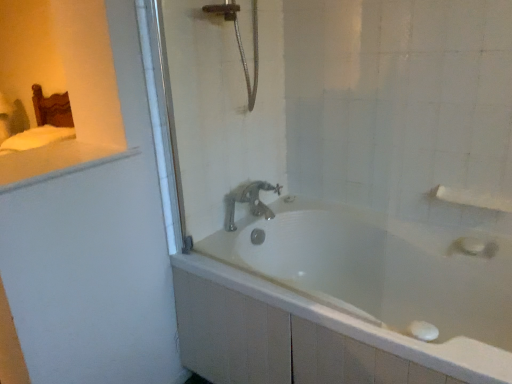
Looking at this image, what is the approximate width of clear glass shower door at center?

19.62 inches.

Describe the element at coordinates (249, 201) in the screenshot. I see `polished chrome faucet at center` at that location.

What do you see at coordinates (345, 300) in the screenshot?
I see `white glossy bathtub at center` at bounding box center [345, 300].

Locate an element on the screen. The height and width of the screenshot is (384, 512). white glossy counter top at upper left is located at coordinates (54, 162).

Is white glossy counter top at upper left turned away from polished chrome faucet at center?

No.

Who is bigger, white glossy counter top at upper left or polished chrome faucet at center?

With larger size is white glossy counter top at upper left.

How distant is white glossy counter top at upper left from polished chrome faucet at center?

They are 68.26 centimeters apart.

Between white glossy bathtub at center and white glossy counter top at upper left, which one has more height?

With more height is white glossy bathtub at center.

Is white glossy bathtub at center next to white glossy counter top at upper left and touching it?

No, white glossy bathtub at center is not in contact with white glossy counter top at upper left.

Image resolution: width=512 pixels, height=384 pixels. What are the coordinates of `bathtub that appears in front of the white glossy counter top at upper left` in the screenshot? It's located at (345, 300).

From a real-world perspective, is clear glass shower door at center above or below white matte towel bar at upper right?

clear glass shower door at center is above white matte towel bar at upper right.

Between clear glass shower door at center and white matte towel bar at upper right, which one is positioned in front?

clear glass shower door at center is closer to the camera.

Is clear glass shower door at center taller than white matte towel bar at upper right?

Yes.

Identify the location of shower door lying on the left of white matte towel bar at upper right. The image size is (512, 384). (220, 104).

How different are the orientations of white matte towel bar at upper right and white glossy bathtub at center in degrees?

The angle between the facing direction of white matte towel bar at upper right and the facing direction of white glossy bathtub at center is 0.000584 degrees.

Consider the image. From a real-world perspective, which object rests below the other?

white glossy bathtub at center is physically lower.

Is white matte towel bar at upper right next to white glossy bathtub at center and touching it?

There is a gap between white matte towel bar at upper right and white glossy bathtub at center.

In the scene shown: Is white glossy counter top at upper left at the right side of white glossy bathtub at center?

No, white glossy counter top at upper left is not to the right of white glossy bathtub at center.

From a real-world perspective, between white glossy counter top at upper left and white glossy bathtub at center, who is vertically higher?

white glossy counter top at upper left, from a real-world perspective.

From the image's perspective, relative to white glossy bathtub at center, is white glossy counter top at upper left above or below?

Based on their image positions, white glossy counter top at upper left is located above white glossy bathtub at center.

Are white matte towel bar at upper right and white glossy counter top at upper left located far from each other?

white matte towel bar at upper right is far away from white glossy counter top at upper left.

Would you say white glossy counter top at upper left is part of white matte towel bar at upper right's contents?

That's incorrect, white glossy counter top at upper left is not inside white matte towel bar at upper right.

Consider the image. How far apart are white matte towel bar at upper right and white glossy counter top at upper left?

They are 4.36 feet apart.

Is white matte towel bar at upper right further to camera compared to white glossy counter top at upper left?

Yes, it is.

From the image's perspective, is polished chrome faucet at center located above or below white glossy bathtub at center?

polished chrome faucet at center is above white glossy bathtub at center.

From a real-world perspective, relative to white glossy bathtub at center, is polished chrome faucet at center vertically above or below?

polished chrome faucet at center is above white glossy bathtub at center.

How distant is polished chrome faucet at center from white glossy bathtub at center?

polished chrome faucet at center is 17.66 inches away from white glossy bathtub at center.

Where is `tap on the right of white glossy counter top at upper left`? The image size is (512, 384). tap on the right of white glossy counter top at upper left is located at coordinates (249, 201).

Find the location of a particular element. The width and height of the screenshot is (512, 384). counter top above the white glossy bathtub at center (from the image's perspective) is located at coordinates (54, 162).

From the image, which object appears to be farther from white matte towel bar at upper right, white glossy counter top at upper left or white glossy bathtub at center?

The object further to white matte towel bar at upper right is white glossy counter top at upper left.

Based on their spatial positions, is white glossy counter top at upper left or clear glass shower door at center further from polished chrome faucet at center?

The object further to polished chrome faucet at center is white glossy counter top at upper left.

From the image, which object appears to be farther from white glossy bathtub at center, white matte towel bar at upper right or clear glass shower door at center?

Based on the image, white matte towel bar at upper right appears to be further to white glossy bathtub at center.

Looking at the image, which one is located further to clear glass shower door at center, white glossy counter top at upper left or white glossy bathtub at center?

white glossy bathtub at center is positioned further to the anchor clear glass shower door at center.

Considering their positions, is white glossy bathtub at center positioned further to white matte towel bar at upper right than clear glass shower door at center?

Among the two, clear glass shower door at center is located further to white matte towel bar at upper right.

Considering their positions, is white glossy bathtub at center positioned further to white glossy counter top at upper left than clear glass shower door at center?

Based on the image, white glossy bathtub at center appears to be further to white glossy counter top at upper left.

When comparing their distances from white matte towel bar at upper right, does white glossy counter top at upper left or polished chrome faucet at center seem further?

white glossy counter top at upper left lies further to white matte towel bar at upper right than the other object.

From the image, which object appears to be nearer to white glossy bathtub at center, clear glass shower door at center or white matte towel bar at upper right?

Based on the image, clear glass shower door at center appears to be nearer to white glossy bathtub at center.

Where is `bathtub situated between white glossy counter top at upper left and white matte towel bar at upper right from left to right`? The height and width of the screenshot is (384, 512). bathtub situated between white glossy counter top at upper left and white matte towel bar at upper right from left to right is located at coordinates (345, 300).

You are a GUI agent. You are given a task and a screenshot of the screen. Output one action in this format:
    pyautogui.click(x=<x>, y=<y>)
    Task: Click on the counter top between clear glass shower door at center and polished chrome faucet at center along the z-axis
    The image size is (512, 384).
    Given the screenshot: What is the action you would take?
    pyautogui.click(x=54, y=162)

At what (x,y) coordinates should I click in order to perform the action: click on tap between clear glass shower door at center and white matte towel bar at upper right from left to right. Please return your answer as a coordinate pair (x, y). The image size is (512, 384). Looking at the image, I should click on (249, 201).

Locate an element on the screen. The image size is (512, 384). bathtub between clear glass shower door at center and white matte towel bar at upper right from left to right is located at coordinates (345, 300).